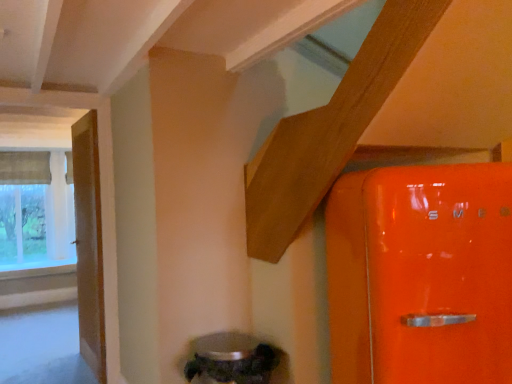
The image size is (512, 384). I want to click on textured fabric window at left, so click(x=37, y=216).

What do you see at coordinates (38, 271) in the screenshot?
I see `clear glass window sill at lower left` at bounding box center [38, 271].

Locate an element on the screen. wooden door at left is located at coordinates (89, 243).

Which is behind, point (48, 269) or point (16, 193)?

The point (16, 193) is farther from the camera.

From their relative heights in the image, would you say clear glass window sill at lower left is taller or shorter than textured fabric window at left?

Considering their sizes, clear glass window sill at lower left has less height than textured fabric window at left.

Is the depth of metallic silver water heater at lower center greater than that of textured fabric window at left?

No, it is in front of textured fabric window at left.

This screenshot has width=512, height=384. In order to click on water heater below the textured fabric window at left (from the image's perspective) in this screenshot , I will do `click(231, 359)`.

Does point (240, 361) appear closer or farther from the camera than point (57, 176)?

Point (240, 361) appears to be closer to the viewer than point (57, 176).

Does metallic silver water heater at lower center contain textured fabric window at left?

No, textured fabric window at left is not surrounded by metallic silver water heater at lower center.

From the image's perspective, which object appears higher, textured fabric window at left or metallic silver water heater at lower center?

From the image's view, textured fabric window at left is above.

Looking at this image, is textured fabric window at left in contact with metallic silver water heater at lower center?

No, textured fabric window at left is not beside metallic silver water heater at lower center.

Which of these two, textured fabric window at left or metallic silver water heater at lower center, is thinner?

textured fabric window at left is thinner.

Is textured fabric window at left inside or outside of metallic silver water heater at lower center?

textured fabric window at left is not enclosed by metallic silver water heater at lower center.

Is wooden door at left looking in the opposite direction of metallic silver water heater at lower center?

No, wooden door at left is not facing away from metallic silver water heater at lower center.

From a real-world perspective, is wooden door at left under metallic silver water heater at lower center?

No.

Which is more to the left, wooden door at left or metallic silver water heater at lower center?

Positioned to the left is wooden door at left.

Which point is more distant from viewer, [73,128] or [228,345]?

Positioned behind is point [73,128].

Is wooden door at left thinner than clear glass window sill at lower left?

Yes.

Considering the relative positions of wooden door at left and clear glass window sill at lower left in the image provided, is wooden door at left to the right of clear glass window sill at lower left from the viewer's perspective?

Indeed, wooden door at left is positioned on the right side of clear glass window sill at lower left.

From the image's perspective, who appears lower, wooden door at left or clear glass window sill at lower left?

clear glass window sill at lower left appears lower in the image.

How different are the orientations of wooden door at left and clear glass window sill at lower left in degrees?

There is a 83.1-degree angle between the facing directions of wooden door at left and clear glass window sill at lower left.

Looking at their sizes, would you say clear glass window sill at lower left is wider or thinner than metallic silver water heater at lower center?

Considering their sizes, clear glass window sill at lower left looks broader than metallic silver water heater at lower center.

Identify the location of window sill beneath the metallic silver water heater at lower center (from a real-world perspective). click(x=38, y=271).

Which object is positioned more to the right, clear glass window sill at lower left or metallic silver water heater at lower center?

metallic silver water heater at lower center.

Considering the relative sizes of wooden door at left and textured fabric window at left in the image provided, is wooden door at left taller than textured fabric window at left?

Indeed, wooden door at left has a greater height compared to textured fabric window at left.

Is wooden door at left further to the viewer compared to textured fabric window at left?

No, it is not.

Locate an element on the screen. door in front of the textured fabric window at left is located at coordinates click(89, 243).

Consider the image. Is wooden door at left oriented towards textured fabric window at left?

No, wooden door at left does not turn towards textured fabric window at left.

Find the location of `window behind the clear glass window sill at lower left`. window behind the clear glass window sill at lower left is located at coordinates 37,216.

The image size is (512, 384). Identify the location of water heater directly beneath the textured fabric window at left (from a real-world perspective). (231, 359).

Based on their spatial positions, is textured fabric window at left or metallic silver water heater at lower center closer to wooden door at left?

metallic silver water heater at lower center is closer to wooden door at left.

Which object lies further to the anchor point textured fabric window at left, metallic silver water heater at lower center or clear glass window sill at lower left?

metallic silver water heater at lower center is further to textured fabric window at left.

Based on the photo, which object lies nearer to the anchor point clear glass window sill at lower left, textured fabric window at left or metallic silver water heater at lower center?

textured fabric window at left lies closer to clear glass window sill at lower left than the other object.

When comparing their distances from metallic silver water heater at lower center, does wooden door at left or textured fabric window at left seem further?

textured fabric window at left lies further to metallic silver water heater at lower center than the other object.

From the image, which object appears to be farther from wooden door at left, metallic silver water heater at lower center or clear glass window sill at lower left?

clear glass window sill at lower left is positioned further to the anchor wooden door at left.

Based on their spatial positions, is wooden door at left or clear glass window sill at lower left closer to textured fabric window at left?

The object closer to textured fabric window at left is clear glass window sill at lower left.

Looking at the image, which one is located closer to metallic silver water heater at lower center, wooden door at left or clear glass window sill at lower left?

The object closer to metallic silver water heater at lower center is wooden door at left.

Estimate the real-world distances between objects in this image. Which object is closer to clear glass window sill at lower left, metallic silver water heater at lower center or textured fabric window at left?

The object closer to clear glass window sill at lower left is textured fabric window at left.

Image resolution: width=512 pixels, height=384 pixels. I want to click on window sill positioned between wooden door at left and textured fabric window at left from near to far, so click(x=38, y=271).

At what (x,y) coordinates should I click in order to perform the action: click on window sill located between metallic silver water heater at lower center and textured fabric window at left in the depth direction. Please return your answer as a coordinate pair (x, y). The width and height of the screenshot is (512, 384). Looking at the image, I should click on (38, 271).

Find the location of `door positioned between metallic silver water heater at lower center and textured fabric window at left from near to far`. door positioned between metallic silver water heater at lower center and textured fabric window at left from near to far is located at coordinates (89, 243).

This screenshot has height=384, width=512. In order to click on door between metallic silver water heater at lower center and clear glass window sill at lower left along the z-axis in this screenshot , I will do `click(89, 243)`.